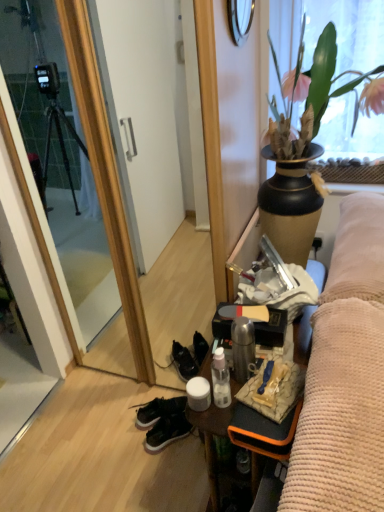
Question: In the image, is metallic circular mirror at upper center on the left side or the right side of black leather sneakers at lower center?

Choices:
 (A) left
 (B) right

Answer: (B)

Question: Do you think metallic circular mirror at upper center is within black leather sneakers at lower center, or outside of it?

Choices:
 (A) inside
 (B) outside

Answer: (B)

Question: Which is nearer to the black leather sneakers at lower center?

Choices:
 (A) black suede sneakers at lower center
 (B) matte black vase with plant at upper right
 (C) metallic silver desk at center
 (D) metallic circular mirror at upper center

Answer: (A)

Question: Which object is positioned closest to the matte black vase with plant at upper right?

Choices:
 (A) metallic silver desk at center
 (B) metallic circular mirror at upper center
 (C) black leather sneakers at lower center
 (D) black suede sneakers at lower center

Answer: (B)